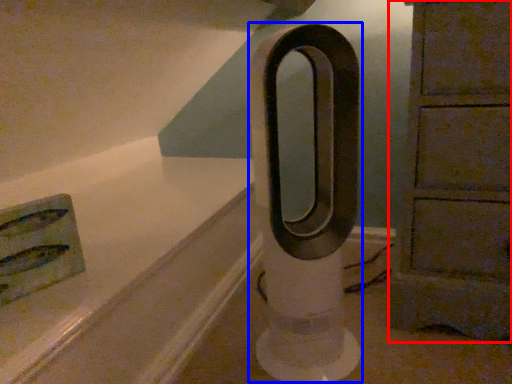
Question: Among these objects, which one is nearest to the camera, furniture (highlighted by a red box) or pillar (highlighted by a blue box)?

Choices:
 (A) furniture
 (B) pillar

Answer: (B)